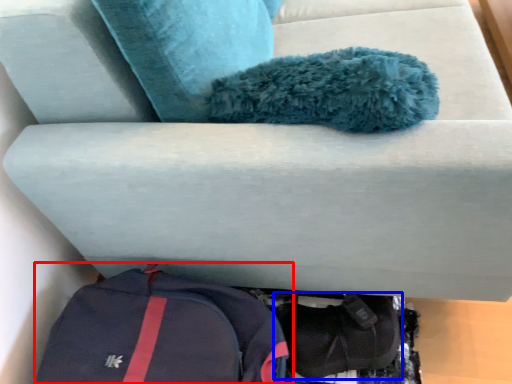
Question: Which point is closer to the camera, backpack (highlighted by a red box) or shoe (highlighted by a blue box)?

Choices:
 (A) backpack
 (B) shoe

Answer: (A)